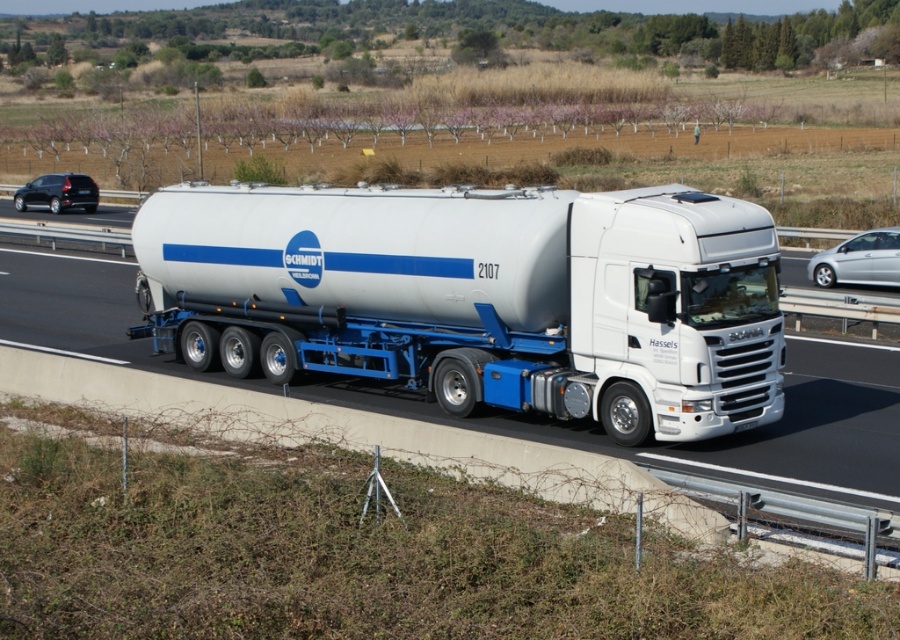
Question: Among these objects, which one is nearest to the camera?

Choices:
 (A) black matte car at left
 (B) silver metallic sedan at right
 (C) white glossy tanker at center

Answer: (C)

Question: Can you confirm if silver metallic sedan at right is smaller than black matte car at left?

Choices:
 (A) no
 (B) yes

Answer: (B)

Question: Which object is farther from the camera taking this photo?

Choices:
 (A) black matte car at left
 (B) silver metallic sedan at right

Answer: (A)

Question: Does white glossy tanker at center appear on the right side of silver metallic sedan at right?

Choices:
 (A) yes
 (B) no

Answer: (B)

Question: Which point is closer to the camera?

Choices:
 (A) white glossy tanker at center
 (B) silver metallic sedan at right
 (C) black matte car at left

Answer: (A)

Question: Is white glossy tanker at center below silver metallic sedan at right?

Choices:
 (A) no
 (B) yes

Answer: (B)